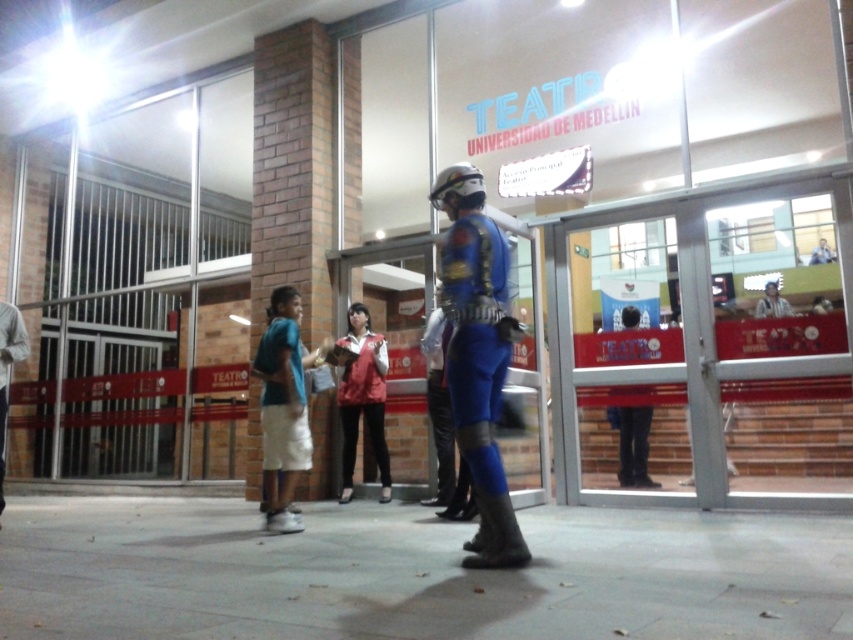
You are an event planner organizing a costume showcase at the Teatro Universidad de Medellin. You have two costumes to display next to each other in the entrance area. The matte blue costume at center and the blue fabric pants at left. Which costume should be placed closer to the entrance to ensure both are visible to visitors entering the theater?

The matte blue costume at center is smaller than the blue fabric pants at left. To ensure both are visible, the larger blue fabric pants at left should be placed closer to the entrance so that visitors can easily see it from a distance, while the smaller matte blue costume at center can be positioned slightly behind it.